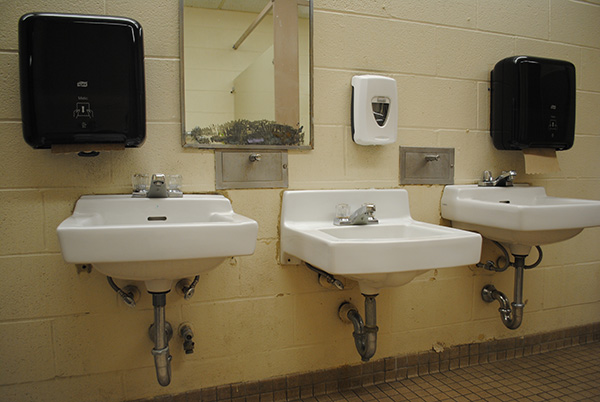
Where is `dark gray j-shaped pipe`? dark gray j-shaped pipe is located at coordinates (369, 344).